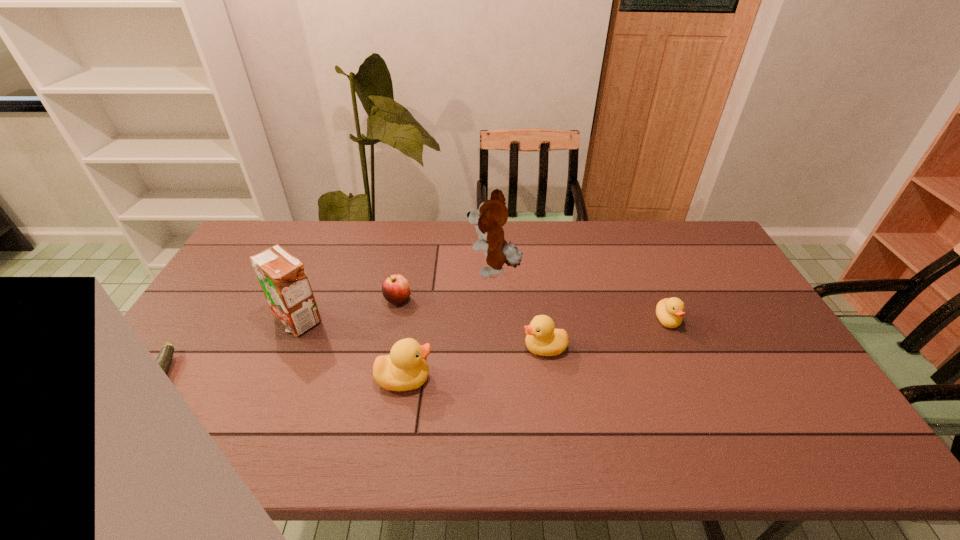
Please point a free position for a duckling on the left. Please provide its 2D coordinates. Your answer should be formatted as a tuple, i.e. [(x, y)], where the tuple contains the x and y coordinates of a point satisfying the conditions above.

[(244, 415)]